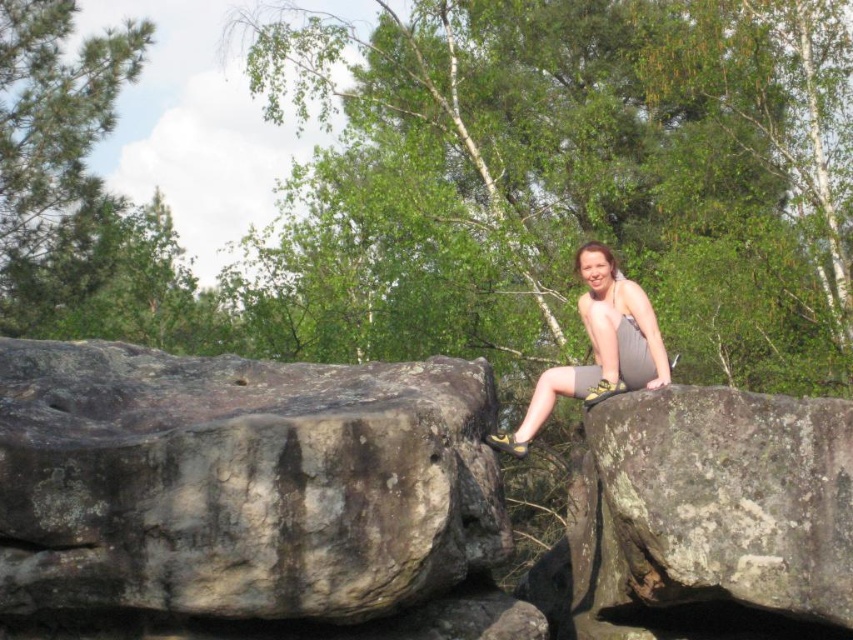
Question: Which of the following is the farthest from the observer?

Choices:
 (A) gray fabric shorts at center
 (B) lichen-covered rock at center
 (C) gray rough rock at left

Answer: (A)

Question: Can you confirm if lichen-covered rock at center is positioned to the right of gray fabric shorts at center?

Choices:
 (A) no
 (B) yes

Answer: (B)

Question: Which of the following is the closest to the observer?

Choices:
 (A) (596, 340)
 (B) (317, 472)
 (C) (714, 500)

Answer: (B)

Question: Is lichen-covered rock at center in front of gray fabric shorts at center?

Choices:
 (A) yes
 (B) no

Answer: (A)

Question: Does lichen-covered rock at center appear on the right side of gray fabric shorts at center?

Choices:
 (A) yes
 (B) no

Answer: (A)

Question: Among these objects, which one is farthest from the camera?

Choices:
 (A) lichen-covered rock at center
 (B) gray fabric shorts at center

Answer: (B)